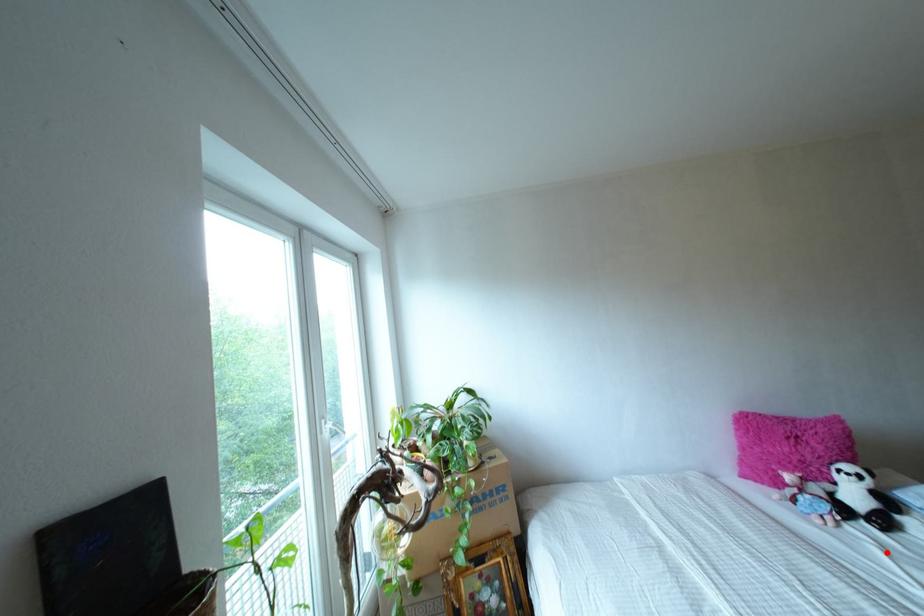
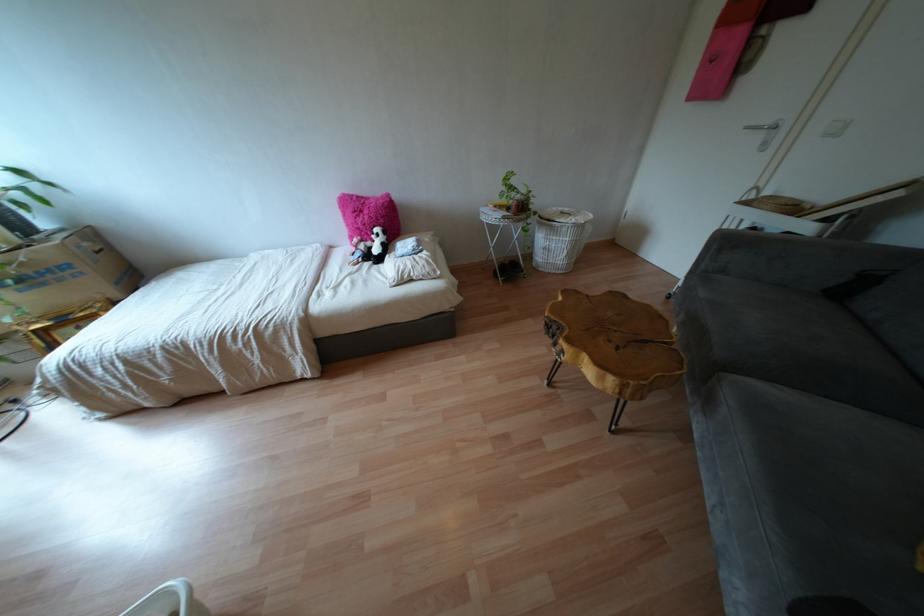
Find the pixel in the second image that matches the highlighted location in the first image.

(349, 274)